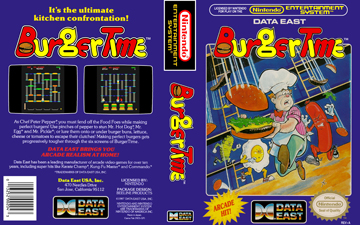
Locate an element on the screen. Image resolution: width=360 pixels, height=225 pixels. rounded corner is located at coordinates (108, 196).